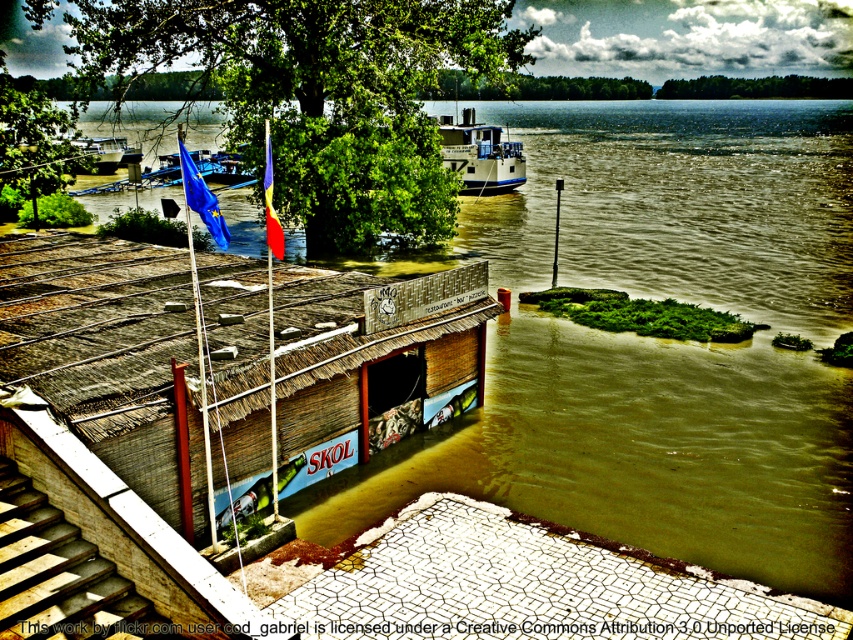
Does wooden stairs at lower left have a greater width compared to metallic silver boat at center?

No.

Is wooden stairs at lower left taller than metallic silver boat at center?

In fact, wooden stairs at lower left may be shorter than metallic silver boat at center.

Image resolution: width=853 pixels, height=640 pixels. I want to click on wooden stairs at lower left, so click(x=61, y=576).

I want to click on wooden stairs at lower left, so click(x=61, y=576).

Can you confirm if brown thatched hut at center is taller than metallic silver boat at center?

No.

Which is more to the right, brown thatched hut at center or metallic silver boat at center?

brown thatched hut at center is more to the right.

Which is behind, point (206, 381) or point (93, 140)?

Point (93, 140)

Image resolution: width=853 pixels, height=640 pixels. Identify the location of brown thatched hut at center. point(227,365).

Does brown thatched hut at center have a greater width compared to wooden stairs at lower left?

Indeed, brown thatched hut at center has a greater width compared to wooden stairs at lower left.

Is brown thatched hut at center closer to camera compared to wooden stairs at lower left?

No, it is not.

Is point (428, 307) less distant than point (15, 508)?

No.

Where is `brown thatched hut at center`? The width and height of the screenshot is (853, 640). brown thatched hut at center is located at coordinates (227, 365).